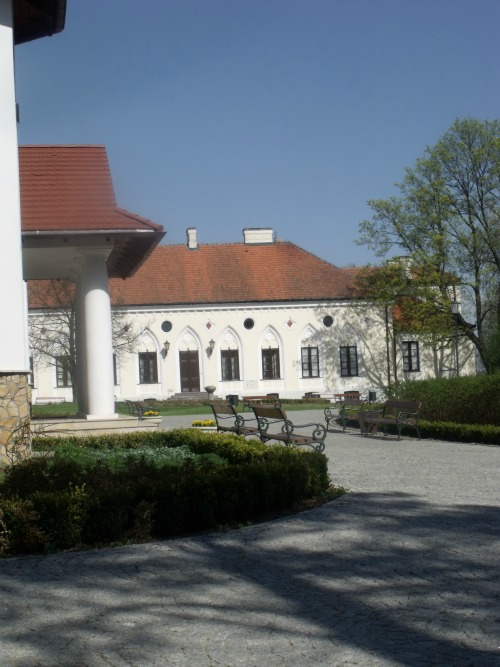
Where is `window`? The width and height of the screenshot is (500, 667). window is located at coordinates (64, 373), (150, 371), (233, 362), (267, 362), (306, 363), (345, 361), (410, 357).